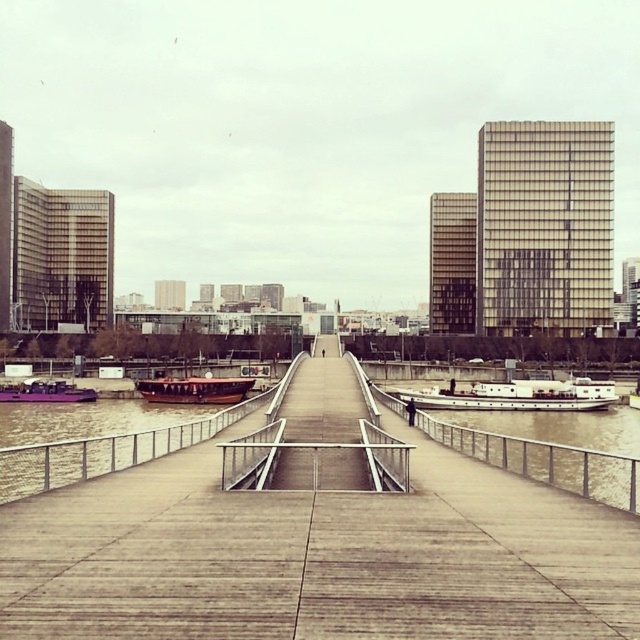
Can you confirm if concrete dock at center is positioned below white matte barge at center-right?

Actually, concrete dock at center is above white matte barge at center-right.

Who is more forward, (240, 516) or (440, 401)?

Positioned in front is point (240, 516).

Describe the element at coordinates (317, 557) in the screenshot. This screenshot has width=640, height=640. I see `concrete dock at center` at that location.

Find the location of a particular element. Image resolution: width=640 pixels, height=640 pixels. concrete dock at center is located at coordinates (317, 557).

Locate an element on the screen. This screenshot has height=640, width=640. metallic silver dock at center is located at coordinates (317, 442).

Can you confirm if metallic silver dock at center is taller than matte purple boat at lower left?

Correct, metallic silver dock at center is much taller as matte purple boat at lower left.

Is point (259, 483) less distant than point (13, 392)?

Yes, it is in front of point (13, 392).

You are a GUI agent. You are given a task and a screenshot of the screen. Output one action in this format:
    pyautogui.click(x=<x>, y=<y>)
    Task: Click on the metallic silver dock at center
    
    Given the screenshot: What is the action you would take?
    pyautogui.click(x=317, y=442)

What do you see at coordinates (317, 557) in the screenshot? The width and height of the screenshot is (640, 640). I see `concrete dock at center` at bounding box center [317, 557].

Identify the location of concrete dock at center. (317, 557).